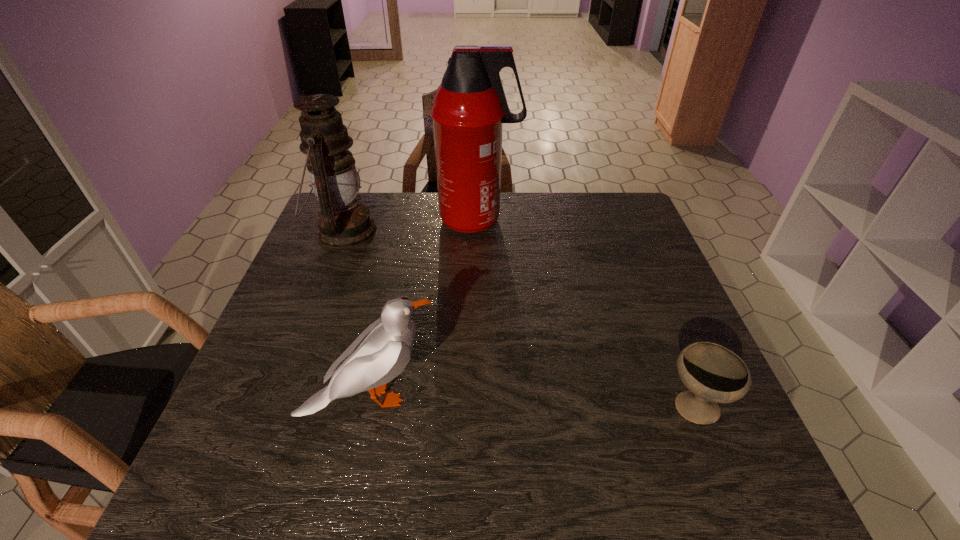
The height and width of the screenshot is (540, 960). I want to click on vacant area between the gull and the shortest object, so click(532, 402).

Image resolution: width=960 pixels, height=540 pixels. Find the location of `object that is the third closest one to the lantern`. object that is the third closest one to the lantern is located at coordinates (713, 374).

This screenshot has height=540, width=960. What are the coordinates of `the second closest object to the fire extinguisher` in the screenshot? It's located at (381, 352).

Locate an element on the screen. This screenshot has height=540, width=960. vacant area in the image that satisfies the following two spatial constraints: 1. at the beak of the shortest object; 2. on the left side of the third tallest object is located at coordinates (370, 407).

Where is `free space that satisfies the following two spatial constraints: 1. at the beak of the third tallest object; 2. on the right side of the shortest object`? The image size is (960, 540). free space that satisfies the following two spatial constraints: 1. at the beak of the third tallest object; 2. on the right side of the shortest object is located at coordinates (370, 407).

Identify the location of vacant space that satisfies the following two spatial constraints: 1. on the trigger side of the fire extinguisher; 2. on the left side of the chalice. (477, 407).

What are the coordinates of `vacant point that satisfies the following two spatial constraints: 1. at the beak of the third tallest object; 2. on the right side of the rightmost object` in the screenshot? It's located at (370, 407).

Identify the location of free space that satisfies the following two spatial constraints: 1. on the trigger side of the tallest object; 2. on the right side of the chalice. (477, 407).

Where is `vacant area in the image that satisfies the following two spatial constraints: 1. at the beak of the second shortest object; 2. on the right side of the chalice`? vacant area in the image that satisfies the following two spatial constraints: 1. at the beak of the second shortest object; 2. on the right side of the chalice is located at coordinates (370, 407).